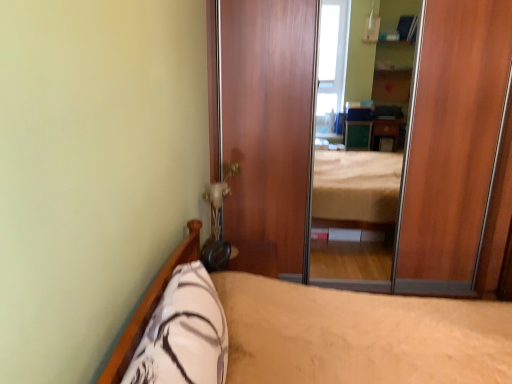
Question: Is wooden screen door at center looking in the opposite direction of white soft pillow at lower left?

Choices:
 (A) yes
 (B) no

Answer: (B)

Question: From the image's perspective, does wooden screen door at center appear lower than white soft pillow at lower left?

Choices:
 (A) no
 (B) yes

Answer: (A)

Question: From a real-world perspective, is wooden screen door at center on top of white soft pillow at lower left?

Choices:
 (A) yes
 (B) no

Answer: (A)

Question: Can you confirm if wooden screen door at center is shorter than white soft pillow at lower left?

Choices:
 (A) yes
 (B) no

Answer: (B)

Question: Is white soft pillow at lower left inside wooden screen door at center?

Choices:
 (A) no
 (B) yes

Answer: (A)

Question: Is wooden screen door at center situated inside white soft pillow at lower left or outside?

Choices:
 (A) outside
 (B) inside

Answer: (A)

Question: Based on their positions, is wooden screen door at center located to the left or right of white soft pillow at lower left?

Choices:
 (A) left
 (B) right

Answer: (B)

Question: Considering the positions of point (229, 145) and point (193, 296), is point (229, 145) closer or farther from the camera than point (193, 296)?

Choices:
 (A) closer
 (B) farther

Answer: (B)

Question: From a real-world perspective, is wooden screen door at center positioned above or below white soft pillow at lower left?

Choices:
 (A) below
 (B) above

Answer: (B)

Question: From their relative heights in the image, would you say beige fabric bed at lower left is taller or shorter than wooden screen door at center?

Choices:
 (A) tall
 (B) short

Answer: (B)

Question: Would you say beige fabric bed at lower left is to the left or to the right of wooden screen door at center in the picture?

Choices:
 (A) left
 (B) right

Answer: (A)

Question: Is beige fabric bed at lower left inside or outside of wooden screen door at center?

Choices:
 (A) inside
 (B) outside

Answer: (B)

Question: From the image's perspective, is beige fabric bed at lower left positioned above or below wooden screen door at center?

Choices:
 (A) above
 (B) below

Answer: (B)

Question: From their relative heights in the image, would you say wooden screen door at center is taller or shorter than beige fabric bed at lower left?

Choices:
 (A) short
 (B) tall

Answer: (B)

Question: In terms of size, does wooden screen door at center appear bigger or smaller than beige fabric bed at lower left?

Choices:
 (A) big
 (B) small

Answer: (B)